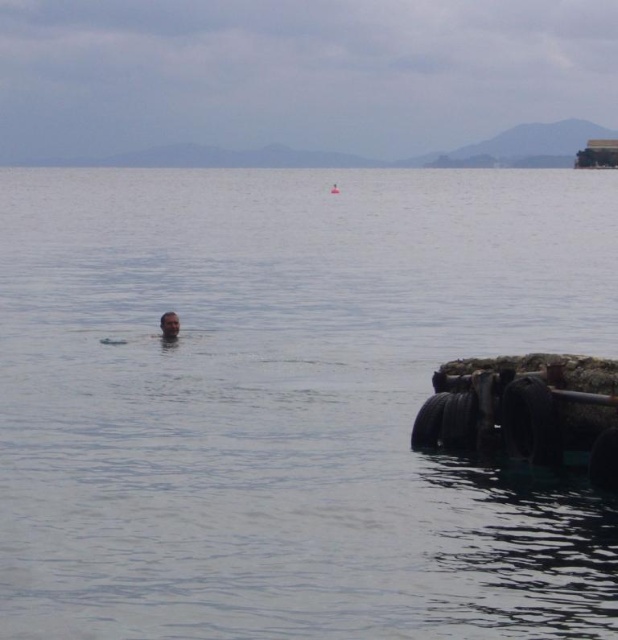
You are a swimmer who wants to reach the shore from the transparent water at center. Which direction should you swim to reach the shore?

The transparent water at center is located at point (x=287, y=403). Since the shore is typically at the edge of the water, you should swim towards the direction opposite to the center coordinates to reach the shore.

You are standing at the edge of the water and see two points in the water. The first point is at coordinates point (598, 442) and the second is at point (336, 193). Which point is closer to you?

Point (598, 442) is closer to the viewer than point (336, 193).

You are a lifeguard on duty and notice a swimmer in the water. You see the transparent water at center and the smooth skin head at center. Which object is above the other?

The transparent water at center is positioned over smooth skin head at center, so the water is above the swimmer.